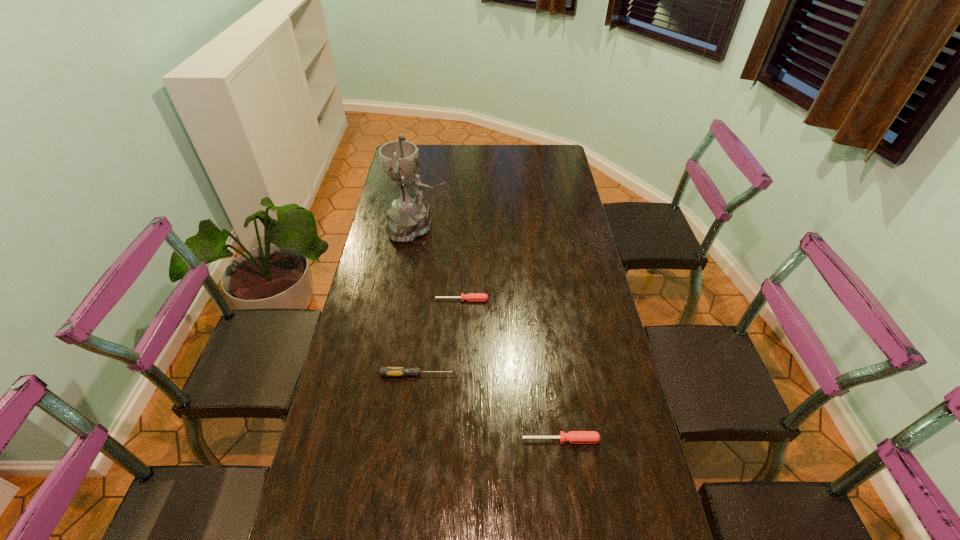
Where is `vacant space that satisfies the following two spatial constraints: 1. on the side with emblem of the rightmost screwdriver; 2. on the right side of the tallest object`? vacant space that satisfies the following two spatial constraints: 1. on the side with emblem of the rightmost screwdriver; 2. on the right side of the tallest object is located at coordinates (384, 440).

Where is `blank space that satisfies the following two spatial constraints: 1. on the back side of the second farthest object; 2. on the side with emblem of the farthest object`? Image resolution: width=960 pixels, height=540 pixels. blank space that satisfies the following two spatial constraints: 1. on the back side of the second farthest object; 2. on the side with emblem of the farthest object is located at coordinates (465, 228).

Identify the location of vacant point that satisfies the following two spatial constraints: 1. insert the second nearest object into a screw head; 2. on the back side of the nearest object. Image resolution: width=960 pixels, height=540 pixels. (410, 440).

The image size is (960, 540). What are the coordinates of `vacant space that satisfies the following two spatial constraints: 1. on the side with emblem of the farthest screwdriver; 2. on the right side of the tallest object` in the screenshot? It's located at (406, 300).

The width and height of the screenshot is (960, 540). In order to click on vacant space that satisfies the following two spatial constraints: 1. on the back side of the rightmost screwdriver; 2. insert the second nearest screwdriver into a screw head in this screenshot , I will do `click(552, 375)`.

Locate an element on the screen. free space that satisfies the following two spatial constraints: 1. on the side with emblem of the rightmost object; 2. on the right side of the farthest object is located at coordinates (384, 440).

At what (x,y) coordinates should I click in order to perform the action: click on free spot that satisfies the following two spatial constraints: 1. insert the rightmost object into a screw head; 2. on the right side of the second farthest screwdriver. Please return your answer as a coordinate pair (x, y). Looking at the image, I should click on (410, 440).

The height and width of the screenshot is (540, 960). I want to click on free location that satisfies the following two spatial constraints: 1. on the side with emblem of the award; 2. on the left side of the third nearest object, so click(406, 300).

I want to click on vacant area in the image that satisfies the following two spatial constraints: 1. on the side with emblem of the tallest object; 2. on the back side of the farthest screwdriver, so click(406, 300).

Locate an element on the screen. This screenshot has height=540, width=960. blank area in the image that satisfies the following two spatial constraints: 1. on the side with emblem of the third nearest object; 2. on the right side of the tallest object is located at coordinates (406, 300).